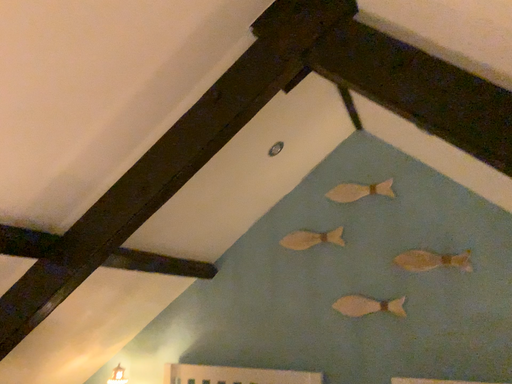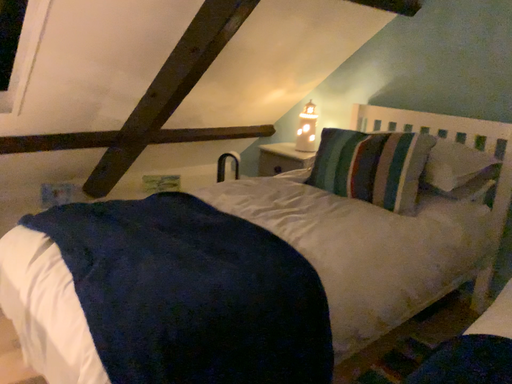
Question: Which way did the camera rotate in the video?

Choices:
 (A) rotated downward
 (B) rotated upward

Answer: (A)